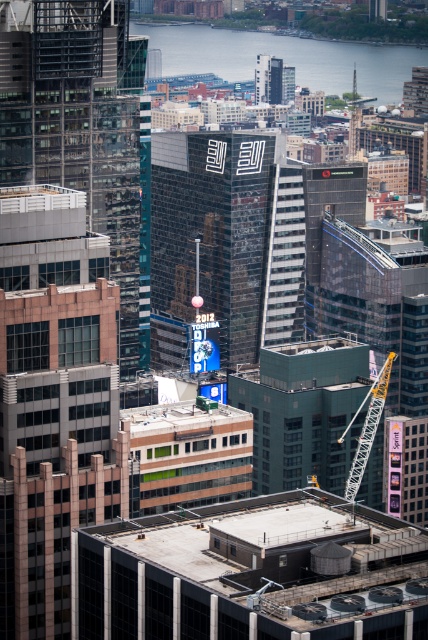
Question: Among these objects, which one is nearest to the camera?

Choices:
 (A) blue glass water at upper center
 (B) glassy black skyscraper at center

Answer: (B)

Question: Which object is positioned closest to the yellow metallic crane at center-right?

Choices:
 (A) blue glass water at upper center
 (B) glassy black skyscraper at center

Answer: (A)

Question: Is glassy black skyscraper at center thinner than yellow metallic crane at center-right?

Choices:
 (A) yes
 (B) no

Answer: (B)

Question: Is blue glass water at upper center to the left of yellow metallic crane at center-right from the viewer's perspective?

Choices:
 (A) yes
 (B) no

Answer: (A)

Question: Which point is farther from the camera taking this photo?

Choices:
 (A) [x=189, y=61]
 (B) [x=356, y=474]

Answer: (A)

Question: Does glassy black skyscraper at center appear on the right side of yellow metallic crane at center-right?

Choices:
 (A) yes
 (B) no

Answer: (B)